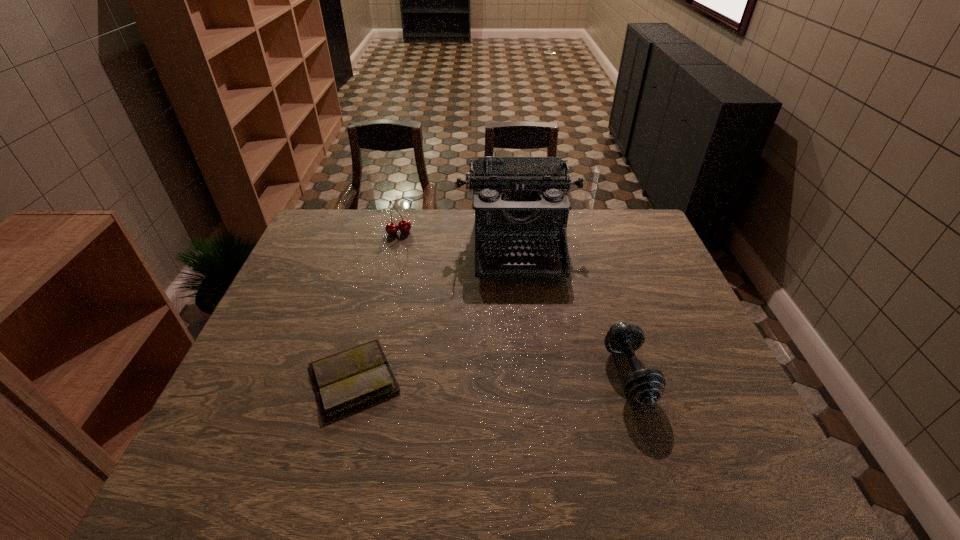
This screenshot has width=960, height=540. What are the coordinates of `free space on the desktop that is between the shortest object and the third tallest object and is positioned with the stems of the cherry pointing upwards` in the screenshot? It's located at (456, 377).

You are a GUI agent. You are given a task and a screenshot of the screen. Output one action in this format:
    pyautogui.click(x=<x>, y=<y>)
    Task: Click on the free space on the desktop that is between the shortest object and the second shortest object and is positioned on the typing side of the tallest object
    The height and width of the screenshot is (540, 960).
    Given the screenshot: What is the action you would take?
    pyautogui.click(x=532, y=376)